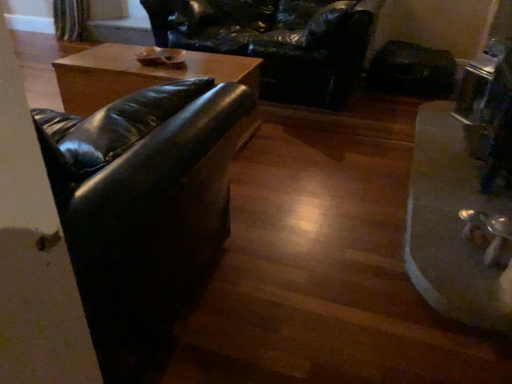
Identify the location of free spot above metallic silver tray at lower right (from a real-world perspective). The image size is (512, 384). (452, 177).